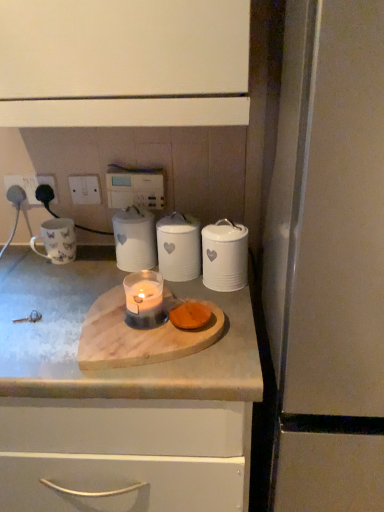
At what (x,y) coordinates should I click in order to perform the action: click on free spot to the left of white ceramic canister at center, the second kitchen appliance from the right. Please return your answer as a coordinate pair (x, y). Looking at the image, I should click on (91, 279).